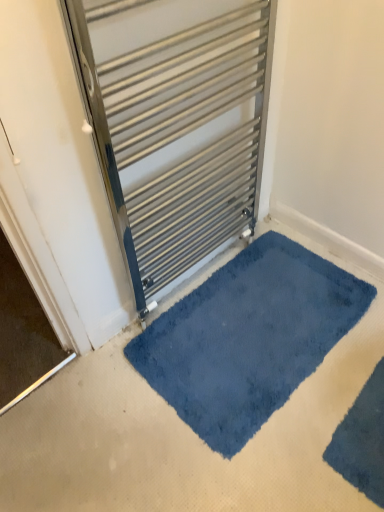
Locate an element on the screen. The height and width of the screenshot is (512, 384). free region under velvety blue bath mat at lower right, positioned as the 2th bath mat in back-to-front order (from a real-world perspective) is located at coordinates (363, 449).